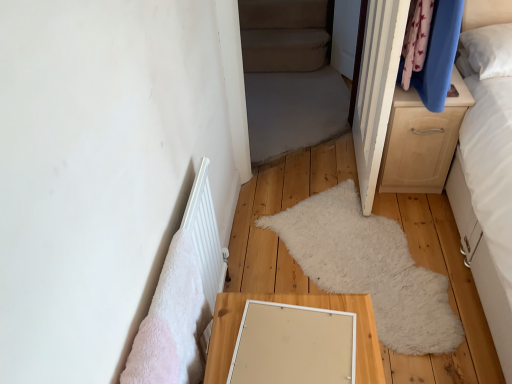
Locate an element on the screen. The image size is (512, 384). vacant region above white fluffy mat at center (from a real-world perspective) is located at coordinates (339, 238).